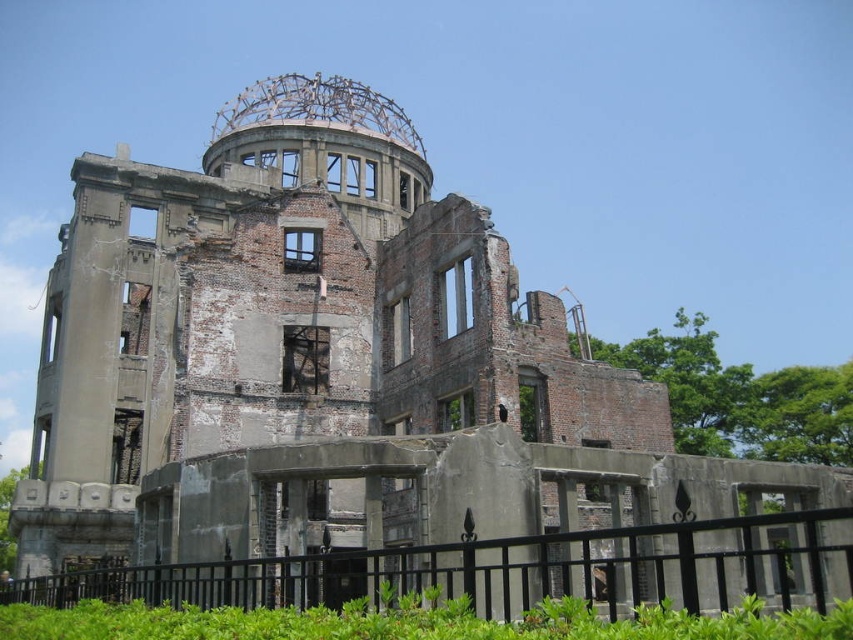
Question: Observing the image, what is the correct spatial positioning of concrete ruins at center in reference to black metal fence at lower center?

Choices:
 (A) above
 (B) below

Answer: (A)

Question: Among these objects, which one is nearest to the camera?

Choices:
 (A) concrete ruins at center
 (B) black metal fence at lower center

Answer: (B)

Question: Observing the image, what is the correct spatial positioning of concrete ruins at center in reference to black metal fence at lower center?

Choices:
 (A) left
 (B) right

Answer: (A)

Question: Which point is farther to the camera?

Choices:
 (A) black metal fence at lower center
 (B) concrete ruins at center

Answer: (B)

Question: Is concrete ruins at center above black metal fence at lower center?

Choices:
 (A) yes
 (B) no

Answer: (A)